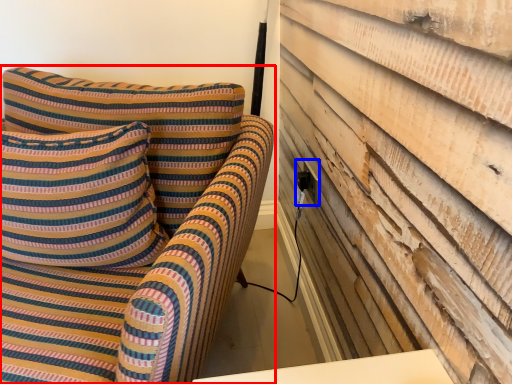
Question: Which of the following is the farthest to the observer, furniture (highlighted by a red box) or electric outlet (highlighted by a blue box)?

Choices:
 (A) furniture
 (B) electric outlet

Answer: (B)